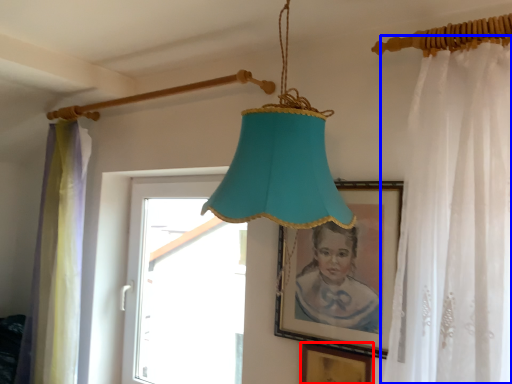
Question: Among these objects, which one is nearest to the camera, picture frame (highlighted by a red box) or curtain (highlighted by a blue box)?

Choices:
 (A) picture frame
 (B) curtain

Answer: (B)